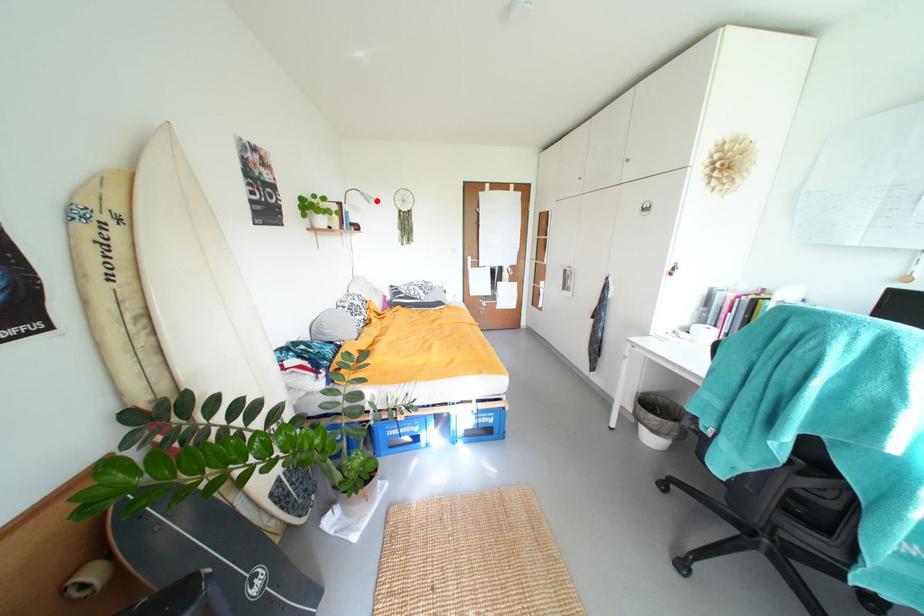
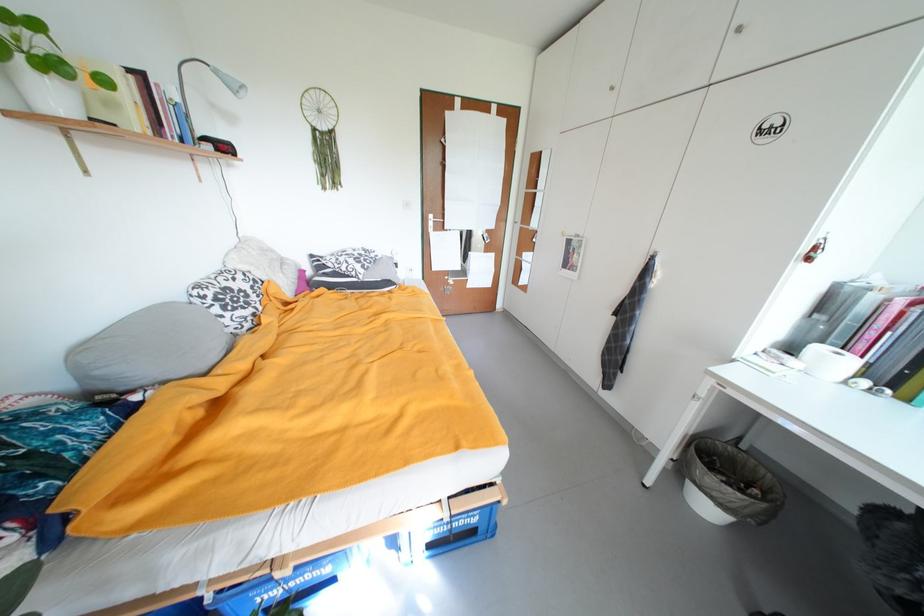
Find the pixel in the second image that matches the highlighted location in the first image.

(244, 90)